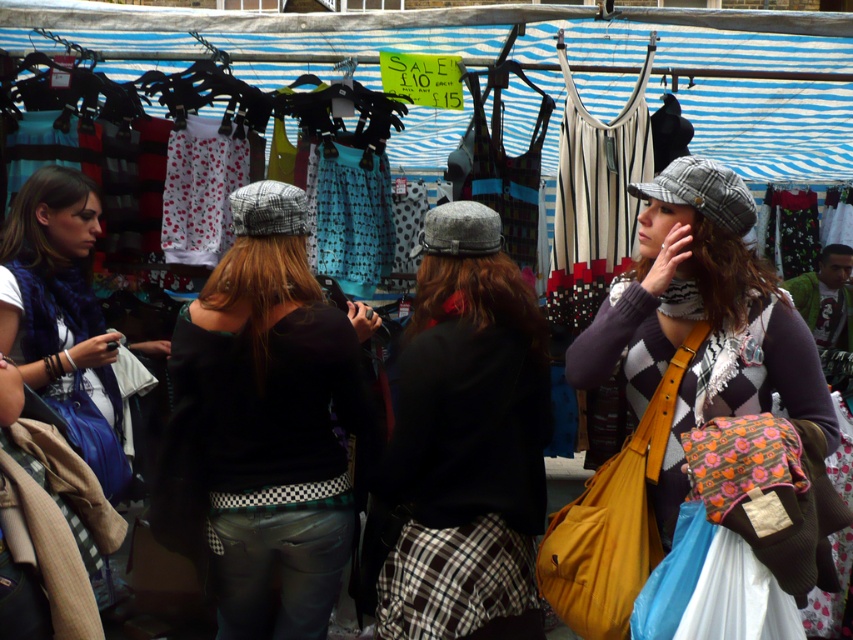
Question: From the image, what is the correct spatial relationship of black checkered belt at center in relation to black woolen sweater at center?

Choices:
 (A) above
 (B) below

Answer: (A)

Question: Does black checkered belt at center come behind plaid wool cap at center?

Choices:
 (A) yes
 (B) no

Answer: (A)

Question: Which of the following is the closest to the observer?

Choices:
 (A) plaid wool cap at center
 (B) black checkered belt at center
 (C) black woolen sweater at center

Answer: (A)

Question: Which of the following is the closest to the observer?

Choices:
 (A) (543, 467)
 (B) (213, 508)
 (C) (676, 243)

Answer: (C)

Question: Is the position of black woolen sweater at center more distant than that of plaid wool cap at center?

Choices:
 (A) yes
 (B) no

Answer: (A)

Question: Considering the real-world distances, which object is farthest from the black woolen sweater at center?

Choices:
 (A) black checkered belt at center
 (B) plaid wool cap at center

Answer: (B)